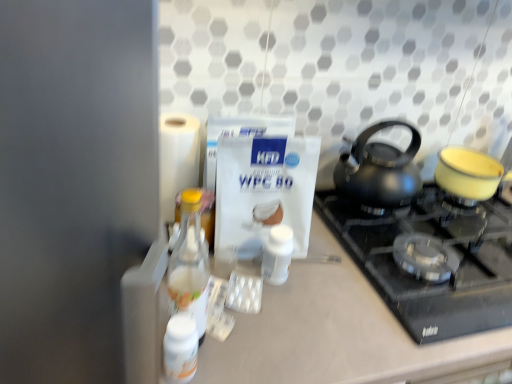
Locate an element on the screen. The width and height of the screenshot is (512, 384). free spot to the right of white glossy bottle at lower left, which ranks as the 2th bottle in back-to-front order is located at coordinates (274, 350).